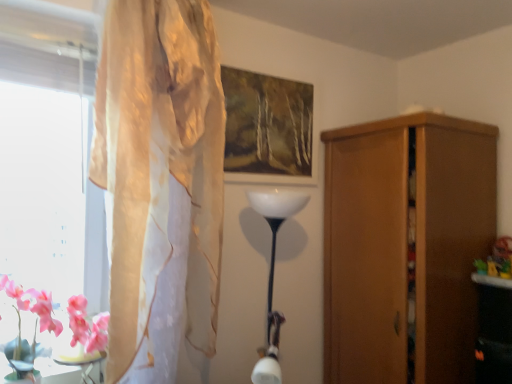
Question: From their relative heights in the image, would you say translucent beige curtain at left is taller or shorter than pink silk flowers at lower left?

Choices:
 (A) tall
 (B) short

Answer: (A)

Question: From the image's perspective, is translucent beige curtain at left above or below pink silk flowers at lower left?

Choices:
 (A) below
 (B) above

Answer: (B)

Question: Which object is positioned farthest from the wooden cupboard at right?

Choices:
 (A) pink glossy table at lower left
 (B) matte wooden picture frame at upper center
 (C) pink silk flowers at lower left
 (D) translucent beige curtain at left

Answer: (A)

Question: Which object is the closest to the pink silk flowers at lower left?

Choices:
 (A) wooden cupboard at right
 (B) matte wooden picture frame at upper center
 (C) translucent beige curtain at left
 (D) pink glossy table at lower left

Answer: (D)